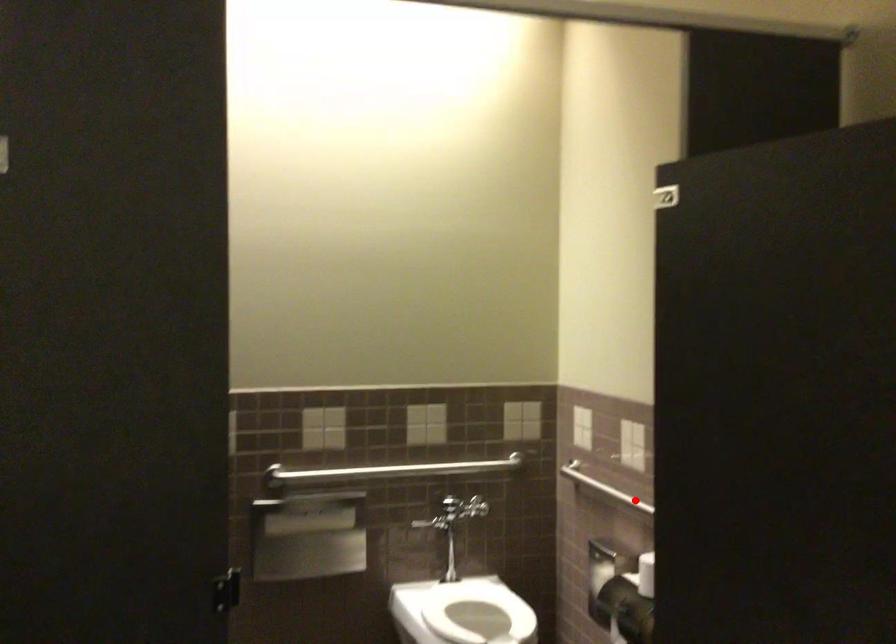
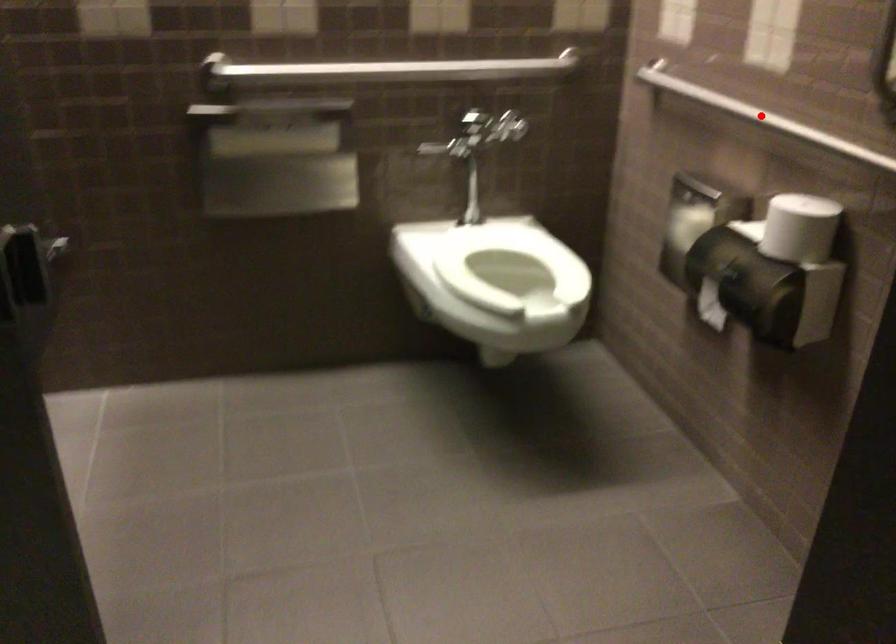
I am providing you with two images of the same scene from different viewpoints. A red point is marked on the first image and another point is marked on the second image. Do the highlighted points in image1 and image2 indicate the same real-world spot?

Yes